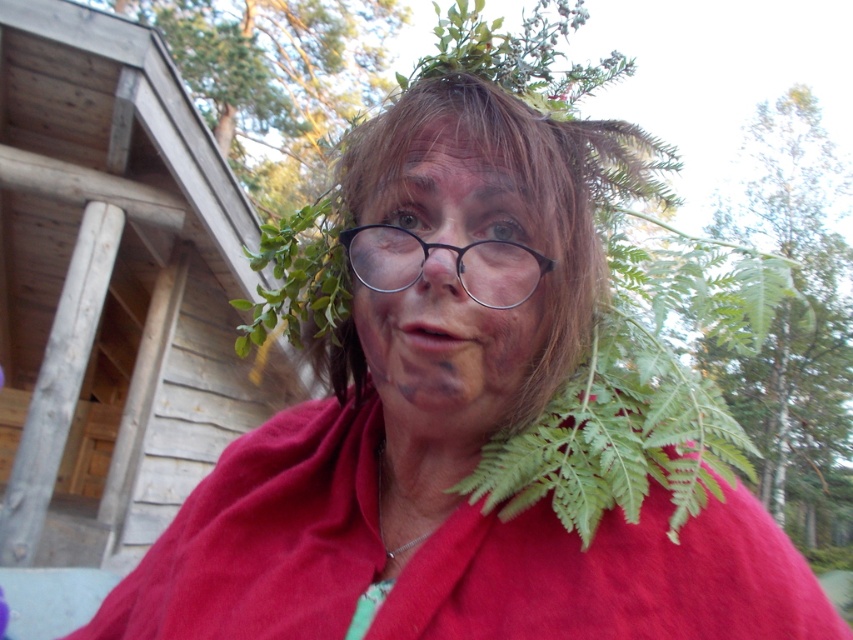
Can you confirm if matte black face at center is wider than metallic round glasses at center?

No, matte black face at center is not wider than metallic round glasses at center.

Can you confirm if matte black face at center is positioned to the right of metallic round glasses at center?

Indeed, matte black face at center is positioned on the right side of metallic round glasses at center.

Between point (381, 177) and point (515, 276), which one is positioned in front?

Point (515, 276) is more forward.

I want to click on matte black face at center, so click(450, 285).